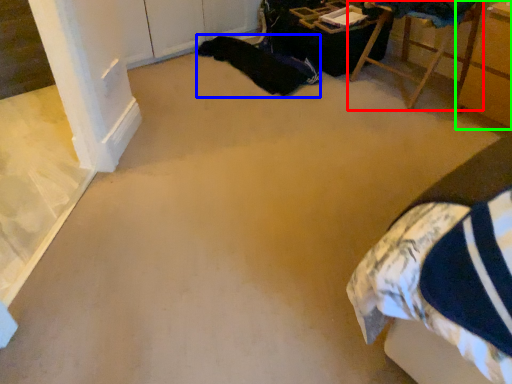
Question: Which object is positioned farthest from furniture (highlighted by a red box)? Select from blanket (highlighted by a blue box) and furniture (highlighted by a green box).

Choices:
 (A) blanket
 (B) furniture

Answer: (A)